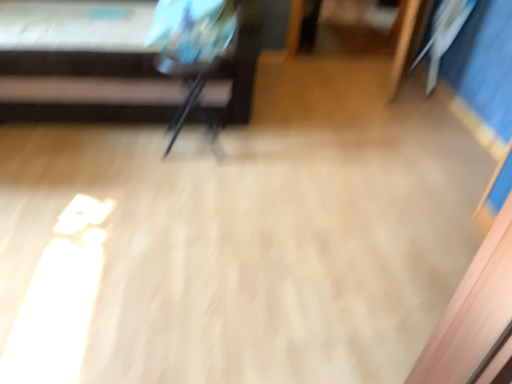
Question: From the image's perspective, relative to metallic silver tripod at upper left, is metallic black armchair at center above or below?

Choices:
 (A) above
 (B) below

Answer: (B)

Question: Considering the positions of metallic black armchair at center and metallic silver tripod at upper left in the image, is metallic black armchair at center taller or shorter than metallic silver tripod at upper left?

Choices:
 (A) tall
 (B) short

Answer: (B)

Question: Is point (202, 110) positioned closer to the camera than point (141, 117)?

Choices:
 (A) farther
 (B) closer

Answer: (B)

Question: In the image, is metallic silver tripod at upper left positioned in front of or behind metallic black armchair at center?

Choices:
 (A) front
 (B) behind

Answer: (A)

Question: Considering the positions of point (71, 3) and point (225, 33), is point (71, 3) closer or farther from the camera than point (225, 33)?

Choices:
 (A) closer
 (B) farther

Answer: (B)

Question: Looking at their shapes, would you say metallic silver tripod at upper left is wider or thinner than metallic black armchair at center?

Choices:
 (A) thin
 (B) wide

Answer: (B)

Question: From the image's perspective, is metallic silver tripod at upper left above or below metallic black armchair at center?

Choices:
 (A) below
 (B) above

Answer: (B)